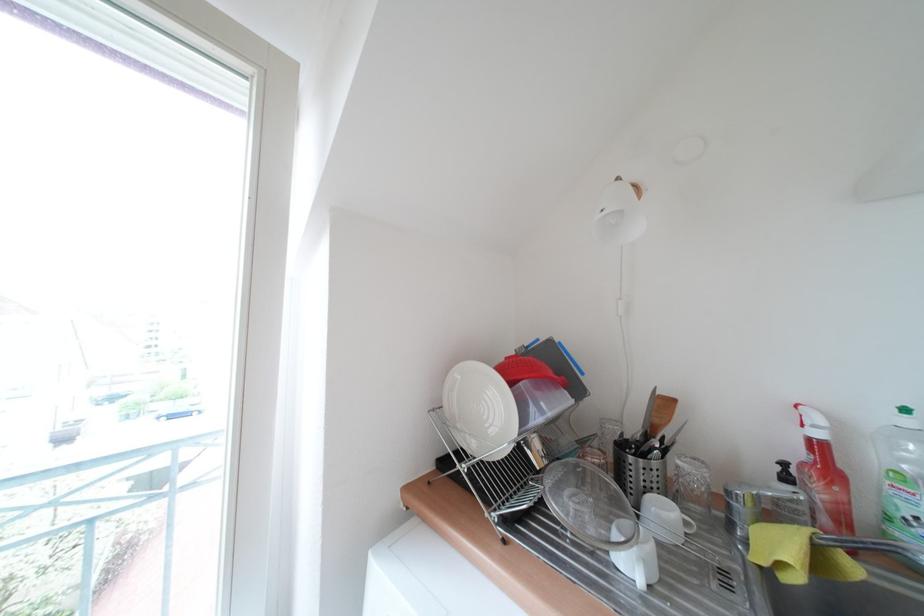
The image size is (924, 616). What do you see at coordinates (619, 305) in the screenshot? I see `the white lamp switch` at bounding box center [619, 305].